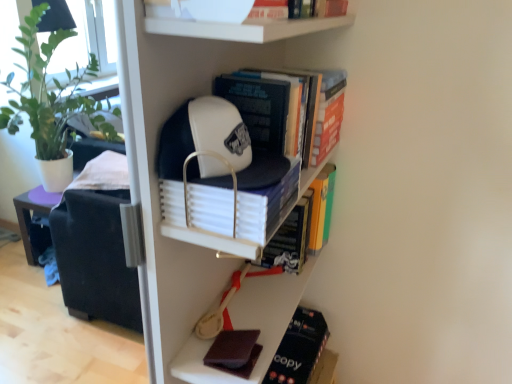
Locate an element on the screen. This screenshot has height=384, width=512. hardcover book at center, the 5th book when ordered from top to bottom is located at coordinates (303, 224).

What are the coordinates of `white matte baseball cap at upper center` in the screenshot? It's located at (157, 185).

This screenshot has height=384, width=512. What do you see at coordinates (267, 206) in the screenshot?
I see `white matte book at center, positioned as the 4th book in top-to-bottom order` at bounding box center [267, 206].

The image size is (512, 384). What do you see at coordinates (329, 113) in the screenshot?
I see `orange matte book at upper right, positioned as the fifth book in bottom-to-top order` at bounding box center [329, 113].

You are a GUI agent. You are given a task and a screenshot of the screen. Output one action in this format:
    pyautogui.click(x=<x>, y=<y>)
    Task: Click on the white matte bowl at upper center, acting as the 6th book starting from the bottom
    The width and height of the screenshot is (512, 384).
    Given the screenshot: What is the action you would take?
    pyautogui.click(x=167, y=10)

The height and width of the screenshot is (384, 512). I want to click on hardcover book at center, the 5th book when ordered from top to bottom, so click(x=303, y=224).

Are dark brown leather book at lower right, acting as the first book starting from the bottom, and dark brown matte book at lower center located far from each other?

dark brown leather book at lower right, acting as the first book starting from the bottom, is near dark brown matte book at lower center, not far away.

Locate an element on the screen. Image resolution: width=512 pixels, height=384 pixels. paperback book on the left of dark brown leather book at lower right, positioned as the sixth book in top-to-bottom order is located at coordinates (234, 352).

Can you confirm if dark brown leather book at lower right, acting as the first book starting from the bottom, is positioned to the left of dark brown matte book at lower center?

Incorrect, dark brown leather book at lower right, acting as the first book starting from the bottom, is not on the left side of dark brown matte book at lower center.

Is dark brown leather book at lower right, positioned as the sixth book in top-to-bottom order, looking in the opposite direction of dark brown matte book at lower center?

No.

Considering their positions, is dark brown matte book at lower center located in front of or behind hardcover book at center, which is the fourth book in bottom-to-top order?

dark brown matte book at lower center is behind hardcover book at center, which is the fourth book in bottom-to-top order.

Considering the sizes of objects dark brown matte book at lower center and hardcover book at center, which is the fourth book in bottom-to-top order, in the image provided, who is bigger, dark brown matte book at lower center or hardcover book at center, which is the fourth book in bottom-to-top order,?

With larger size is hardcover book at center, which is the fourth book in bottom-to-top order.

Can you tell me how much dark brown matte book at lower center and hardcover book at center, which is the fourth book in bottom-to-top order, differ in facing direction?

The facing directions of dark brown matte book at lower center and hardcover book at center, which is the fourth book in bottom-to-top order, are 2.3 degrees apart.

From the image's perspective, which one is positioned higher, dark brown matte book at lower center or hardcover book at center, which is the third book from top to bottom?

hardcover book at center, which is the third book from top to bottom, is shown above in the image.

Between hardcover book at center, which is the third book from top to bottom, and orange matte book at upper right, the 2th book when ordered from top to bottom, which one has larger width?

Wider between the two is hardcover book at center, which is the third book from top to bottom.

Considering the points (340, 80) and (336, 75), which point is behind, point (340, 80) or point (336, 75)?

The point (336, 75) is behind.

Which of these two, hardcover book at center, which is the fourth book in bottom-to-top order, or orange matte book at upper right, positioned as the fifth book in bottom-to-top order, stands taller?

hardcover book at center, which is the fourth book in bottom-to-top order, is taller.

In the image, is white matte bowl at upper center, acting as the 6th book starting from the bottom, on the left side or the right side of orange matte book at upper right, positioned as the fifth book in bottom-to-top order?

white matte bowl at upper center, acting as the 6th book starting from the bottom, is to the left of orange matte book at upper right, positioned as the fifth book in bottom-to-top order.

Considering the sizes of white matte bowl at upper center, acting as the 6th book starting from the bottom, and orange matte book at upper right, the 2th book when ordered from top to bottom, in the image, is white matte bowl at upper center, acting as the 6th book starting from the bottom, wider or thinner than orange matte book at upper right, the 2th book when ordered from top to bottom,?

Considering their sizes, white matte bowl at upper center, acting as the 6th book starting from the bottom, looks slimmer than orange matte book at upper right, the 2th book when ordered from top to bottom.

Considering the relative sizes of white matte bowl at upper center, acting as the 6th book starting from the bottom, and orange matte book at upper right, positioned as the fifth book in bottom-to-top order, in the image provided, is white matte bowl at upper center, acting as the 6th book starting from the bottom, shorter than orange matte book at upper right, positioned as the fifth book in bottom-to-top order,?

Correct, white matte bowl at upper center, acting as the 6th book starting from the bottom, is not as tall as orange matte book at upper right, positioned as the fifth book in bottom-to-top order.

From the image's perspective, is dark brown leather book at lower right, positioned as the sixth book in top-to-bottom order, beneath white matte book at center, the third book from the bottom?

Yes, from the image's perspective, dark brown leather book at lower right, positioned as the sixth book in top-to-bottom order, is beneath white matte book at center, the third book from the bottom.

Would you say dark brown leather book at lower right, positioned as the sixth book in top-to-bottom order, is outside white matte book at center, positioned as the 4th book in top-to-bottom order?

Absolutely, dark brown leather book at lower right, positioned as the sixth book in top-to-bottom order, is external to white matte book at center, positioned as the 4th book in top-to-bottom order.

What's the angular difference between dark brown leather book at lower right, acting as the first book starting from the bottom, and white matte book at center, the third book from the bottom,'s facing directions?

12.6 degrees.

Does point (290, 372) come farther from viewer compared to point (211, 199)?

Yes, it is.

Locate an element on the screen. This screenshot has width=512, height=384. book lying below the hardcover book at center, the 5th book when ordered from top to bottom (from the image's perspective) is located at coordinates pyautogui.click(x=298, y=348).

Could you measure the distance between hardcover book at center, the 5th book when ordered from top to bottom, and dark brown leather book at lower right, positioned as the sixth book in top-to-bottom order?

hardcover book at center, the 5th book when ordered from top to bottom, is 13.46 inches from dark brown leather book at lower right, positioned as the sixth book in top-to-bottom order.

Which of these two, hardcover book at center, which ranks as the 2th book in bottom-to-top order, or dark brown leather book at lower right, acting as the first book starting from the bottom, is bigger?

With larger size is hardcover book at center, which ranks as the 2th book in bottom-to-top order.

From the image's perspective, is hardcover book at center, which ranks as the 2th book in bottom-to-top order, on top of dark brown leather book at lower right, acting as the first book starting from the bottom?

Yes, from the image's perspective, hardcover book at center, which ranks as the 2th book in bottom-to-top order, is over dark brown leather book at lower right, acting as the first book starting from the bottom.

Looking at this image, from the image's perspective, which is below, white matte book at center, the third book from the bottom, or orange matte book at upper right, positioned as the fifth book in bottom-to-top order?

From the image's view, white matte book at center, the third book from the bottom, is below.

Looking at this image, is white matte book at center, positioned as the 4th book in top-to-bottom order, surrounding orange matte book at upper right, positioned as the fifth book in bottom-to-top order?

No, orange matte book at upper right, positioned as the fifth book in bottom-to-top order, is not inside white matte book at center, positioned as the 4th book in top-to-bottom order.

Considering the relative positions of white matte book at center, the third book from the bottom, and orange matte book at upper right, positioned as the fifth book in bottom-to-top order, in the image provided, is white matte book at center, the third book from the bottom, in front of orange matte book at upper right, positioned as the fifth book in bottom-to-top order,?

Yes, white matte book at center, the third book from the bottom, is in front of orange matte book at upper right, positioned as the fifth book in bottom-to-top order.

Identify the location of paperback book located above the dark brown leather book at lower right, acting as the first book starting from the bottom (from a real-world perspective). The image size is (512, 384). (234, 352).

At what (x,y) coordinates should I click in order to perform the action: click on the 2nd book counting from the right side of the dark brown matte book at lower center. Please return your answer as a coordinate pair (x, y). Image resolution: width=512 pixels, height=384 pixels. Looking at the image, I should click on (310, 100).

From the image, which object appears to be farther from white matte bowl at upper center, the 1th book viewed from the top, dark brown leather book at lower right, acting as the first book starting from the bottom, or hardcover book at center, which is the fourth book in bottom-to-top order?

dark brown leather book at lower right, acting as the first book starting from the bottom.

Considering their positions, is orange matte book at upper right, the 2th book when ordered from top to bottom, positioned closer to dark brown leather book at lower right, positioned as the sixth book in top-to-bottom order, than hardcover book at center, the 5th book when ordered from top to bottom?

hardcover book at center, the 5th book when ordered from top to bottom, is positioned closer to the anchor dark brown leather book at lower right, positioned as the sixth book in top-to-bottom order.

When comparing their distances from white matte baseball cap at upper center, does orange matte book at upper right, the 2th book when ordered from top to bottom, or hardcover book at center, the 5th book when ordered from top to bottom, seem closer?

hardcover book at center, the 5th book when ordered from top to bottom, lies closer to white matte baseball cap at upper center than the other object.

When comparing their distances from white matte book at center, positioned as the 4th book in top-to-bottom order, does hardcover book at center, which ranks as the 2th book in bottom-to-top order, or dark brown matte book at lower center seem closer?

Based on the image, dark brown matte book at lower center appears to be nearer to white matte book at center, positioned as the 4th book in top-to-bottom order.

Based on their spatial positions, is white matte bowl at upper center, acting as the 6th book starting from the bottom, or hardcover book at center, which is the fourth book in bottom-to-top order, further from white matte baseball cap at upper center?

white matte bowl at upper center, acting as the 6th book starting from the bottom, is positioned further to the anchor white matte baseball cap at upper center.

Estimate the real-world distances between objects in this image. Which object is further from orange matte book at upper right, positioned as the fifth book in bottom-to-top order, white matte book at center, the third book from the bottom, or white matte baseball cap at upper center?

white matte baseball cap at upper center is positioned further to the anchor orange matte book at upper right, positioned as the fifth book in bottom-to-top order.

From the image, which object appears to be farther from hardcover book at center, the 5th book when ordered from top to bottom, orange matte book at upper right, the 2th book when ordered from top to bottom, or white matte bowl at upper center, the 1th book viewed from the top?

The object further to hardcover book at center, the 5th book when ordered from top to bottom, is white matte bowl at upper center, the 1th book viewed from the top.

Based on their spatial positions, is dark brown matte book at lower center or white matte bowl at upper center, the 1th book viewed from the top, further from dark brown leather book at lower right, positioned as the sixth book in top-to-bottom order?

white matte bowl at upper center, the 1th book viewed from the top, is positioned further to the anchor dark brown leather book at lower right, positioned as the sixth book in top-to-bottom order.

This screenshot has height=384, width=512. Find the location of `paperback book located between white matte baseball cap at upper center and hardcover book at center, the 5th book when ordered from top to bottom, in the depth direction`. paperback book located between white matte baseball cap at upper center and hardcover book at center, the 5th book when ordered from top to bottom, in the depth direction is located at coordinates (234, 352).

Find the location of a particular element. Image resolution: width=512 pixels, height=384 pixels. bookcase between hardcover book at center, which is the third book from top to bottom, and dark brown matte book at lower center, in the vertical direction is located at coordinates (157, 185).

Image resolution: width=512 pixels, height=384 pixels. Identify the location of paperback book between white matte book at center, positioned as the 4th book in top-to-bottom order, and dark brown leather book at lower right, acting as the first book starting from the bottom, in the vertical direction. (234, 352).

Where is `book between white matte book at center, the third book from the bottom, and dark brown leather book at lower right, acting as the first book starting from the bottom, vertically`? The height and width of the screenshot is (384, 512). book between white matte book at center, the third book from the bottom, and dark brown leather book at lower right, acting as the first book starting from the bottom, vertically is located at coordinates (303, 224).